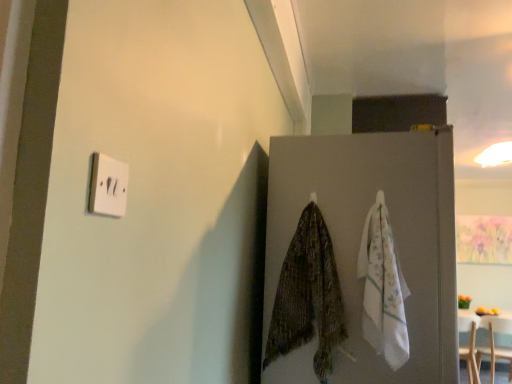
Question: Can you confirm if wooden table at lower right is bigger than textured green scarf at center?

Choices:
 (A) yes
 (B) no

Answer: (A)

Question: From a real-world perspective, is wooden table at lower right positioned under textured green scarf at center based on gravity?

Choices:
 (A) no
 (B) yes

Answer: (B)

Question: Is the depth of wooden table at lower right less than that of textured green scarf at center?

Choices:
 (A) no
 (B) yes

Answer: (A)

Question: Does wooden table at lower right have a smaller size compared to textured green scarf at center?

Choices:
 (A) no
 (B) yes

Answer: (A)

Question: Is textured green scarf at center surrounded by wooden table at lower right?

Choices:
 (A) yes
 (B) no

Answer: (B)

Question: Is wooden table at lower right not within textured green scarf at center?

Choices:
 (A) no
 (B) yes

Answer: (B)

Question: Is textured green scarf at center to the left of white cotton towel at right from the viewer's perspective?

Choices:
 (A) no
 (B) yes

Answer: (B)

Question: Is textured green scarf at center facing towards white cotton towel at right?

Choices:
 (A) yes
 (B) no

Answer: (B)

Question: Does textured green scarf at center have a greater width compared to white cotton towel at right?

Choices:
 (A) yes
 (B) no

Answer: (A)

Question: From the image's perspective, does textured green scarf at center appear lower than white cotton towel at right?

Choices:
 (A) no
 (B) yes

Answer: (B)

Question: Is textured green scarf at center next to white cotton towel at right and touching it?

Choices:
 (A) yes
 (B) no

Answer: (B)

Question: From a real-world perspective, is textured green scarf at center positioned over white cotton towel at right based on gravity?

Choices:
 (A) yes
 (B) no

Answer: (B)

Question: Considering the relative sizes of gray matte refrigerator at center and wooden table at lower right in the image provided, is gray matte refrigerator at center taller than wooden table at lower right?

Choices:
 (A) yes
 (B) no

Answer: (A)